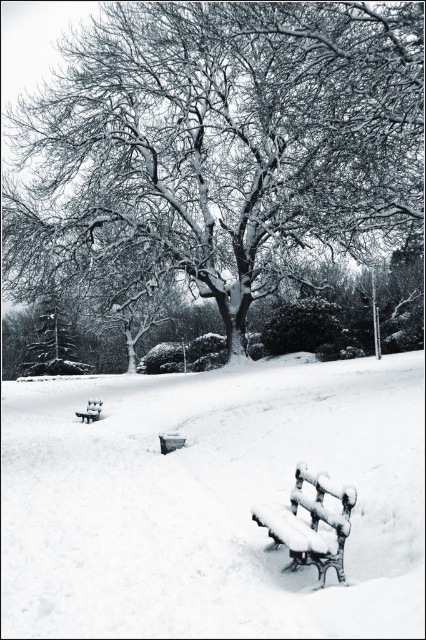
You are standing at the center of the winter scene. Which direction should you walk to reach the white frosted bench at lower right?

You should walk towards the lower right direction to reach the white frosted bench at lower right as it is located at point (210, 500).